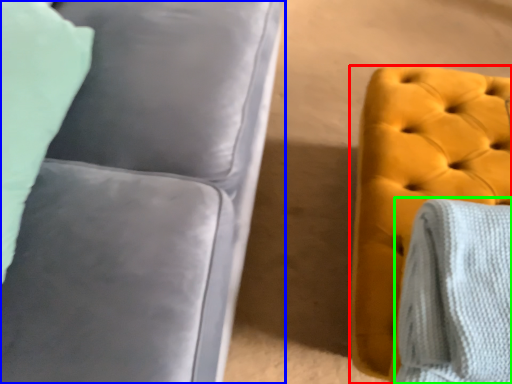
Question: Estimate the real-world distances between objects in this image. Which object is closer to furniture (highlighted by a red box), studio couch (highlighted by a blue box) or blanket (highlighted by a green box)?

Choices:
 (A) studio couch
 (B) blanket

Answer: (B)